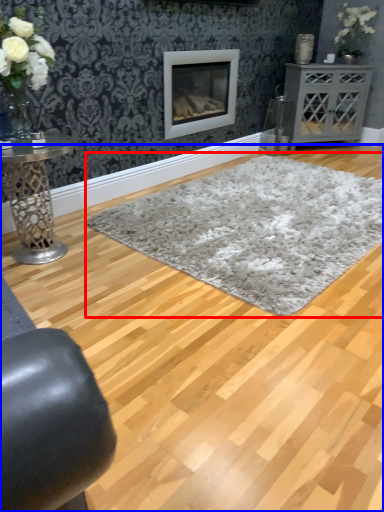
Question: Which of the following is the farthest to the observer, plain (highlighted by a red box) or plain (highlighted by a blue box)?

Choices:
 (A) plain
 (B) plain

Answer: (A)